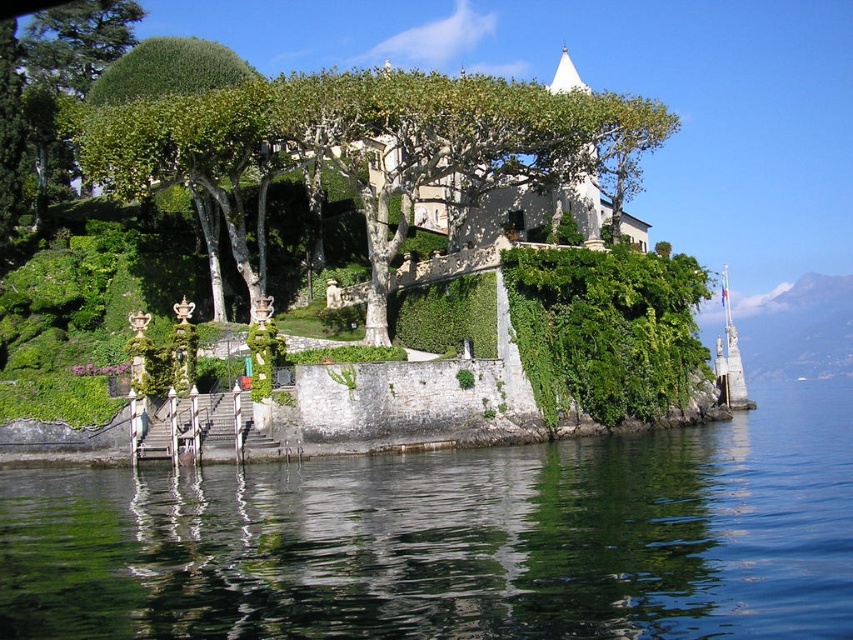
Does transparent water at lower center have a greater height compared to green leafy tree at upper left?

No, transparent water at lower center is not taller than green leafy tree at upper left.

Does transparent water at lower center have a lesser height compared to green leafy tree at upper left?

Indeed, transparent water at lower center has a lesser height compared to green leafy tree at upper left.

Who is more forward, (763,477) or (260,83)?

Point (763,477) is more forward.

Locate an element on the screen. This screenshot has height=640, width=853. transparent water at lower center is located at coordinates (456, 540).

In the scene shown: Does green leafy tree at upper center come behind green leafy tree at upper left?

No.

Locate an element on the screen. This screenshot has height=640, width=853. green leafy tree at upper center is located at coordinates (375, 145).

Can you confirm if green leafy wall at upper center is taller than green leafy tree at upper left?

No, green leafy wall at upper center is not taller than green leafy tree at upper left.

Does green leafy wall at upper center have a lesser height compared to green leafy tree at upper left?

Indeed, green leafy wall at upper center has a lesser height compared to green leafy tree at upper left.

Who is more forward, (554, 378) or (90, 134)?

Point (554, 378)

This screenshot has width=853, height=640. What are the coordinates of `green leafy wall at upper center` in the screenshot? It's located at (605, 328).